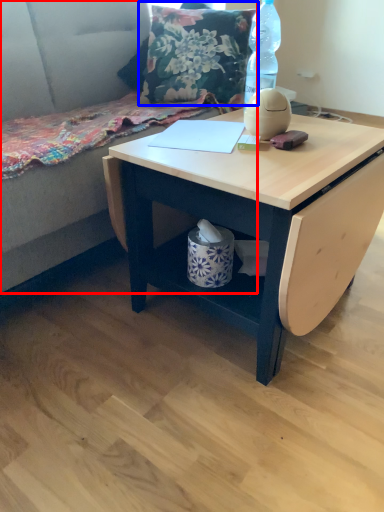
Question: Which point is closer to the camera, couch (highlighted by a red box) or throw pillow (highlighted by a blue box)?

Choices:
 (A) couch
 (B) throw pillow

Answer: (A)